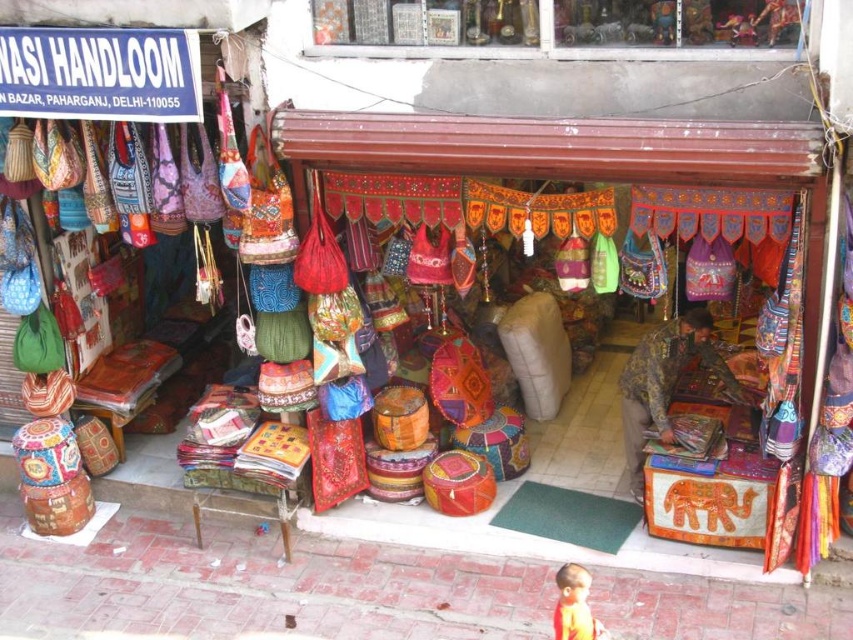
Question: Which of the following is the closest to the observer?

Choices:
 (A) (671, 436)
 (B) (566, 608)

Answer: (B)

Question: Among these objects, which one is farthest from the camera?

Choices:
 (A) orange fabric boy at lower right
 (B) camouflage fabric boy at center

Answer: (B)

Question: Does camouflage fabric boy at center have a greater width compared to orange fabric boy at lower right?

Choices:
 (A) no
 (B) yes

Answer: (B)

Question: Can you confirm if camouflage fabric boy at center is wider than orange fabric boy at lower right?

Choices:
 (A) no
 (B) yes

Answer: (B)

Question: Where is camouflage fabric boy at center located in relation to orange fabric boy at lower right in the image?

Choices:
 (A) below
 (B) above

Answer: (B)